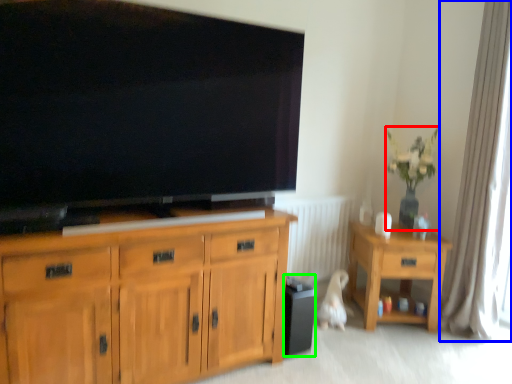
Question: Which object is the farthest from houseplant (highlighted by a red box)? Choose among these: curtain (highlighted by a blue box) or loudspeaker (highlighted by a green box).

Choices:
 (A) curtain
 (B) loudspeaker

Answer: (B)